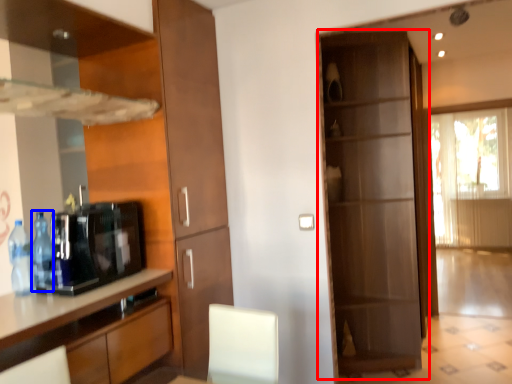
Question: Which object is further to the camera taking this photo, door (highlighted by a red box) or bottle (highlighted by a blue box)?

Choices:
 (A) door
 (B) bottle

Answer: (A)